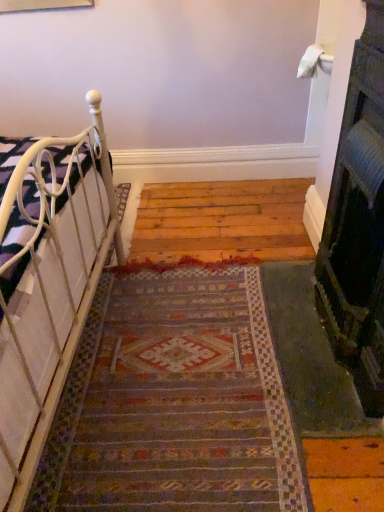
Question: Can you confirm if white metal bed at left is wider than multicolored woven rug at center?

Choices:
 (A) yes
 (B) no

Answer: (B)

Question: Is white metal bed at left outside multicolored woven rug at center?

Choices:
 (A) yes
 (B) no

Answer: (A)

Question: From the image's perspective, does white metal bed at left appear higher than multicolored woven rug at center?

Choices:
 (A) no
 (B) yes

Answer: (B)

Question: Is white metal bed at left not near multicolored woven rug at center?

Choices:
 (A) yes
 (B) no

Answer: (B)

Question: Considering the relative sizes of white metal bed at left and multicolored woven rug at center in the image provided, is white metal bed at left shorter than multicolored woven rug at center?

Choices:
 (A) no
 (B) yes

Answer: (A)

Question: Is white metal bed at left taller than multicolored woven rug at center?

Choices:
 (A) yes
 (B) no

Answer: (A)

Question: From a real-world perspective, is black textured fireplace at right positioned over multicolored woven rug at center based on gravity?

Choices:
 (A) yes
 (B) no

Answer: (A)

Question: From a real-world perspective, is black textured fireplace at right beneath multicolored woven rug at center?

Choices:
 (A) yes
 (B) no

Answer: (B)

Question: Does black textured fireplace at right come in front of multicolored woven rug at center?

Choices:
 (A) yes
 (B) no

Answer: (A)

Question: Is black textured fireplace at right at the left side of multicolored woven rug at center?

Choices:
 (A) yes
 (B) no

Answer: (B)

Question: From the image's perspective, is black textured fireplace at right over multicolored woven rug at center?

Choices:
 (A) yes
 (B) no

Answer: (A)

Question: Is black textured fireplace at right further to camera compared to multicolored woven rug at center?

Choices:
 (A) no
 (B) yes

Answer: (A)

Question: From a real-world perspective, is white metal bed at left below black textured fireplace at right?

Choices:
 (A) yes
 (B) no

Answer: (A)